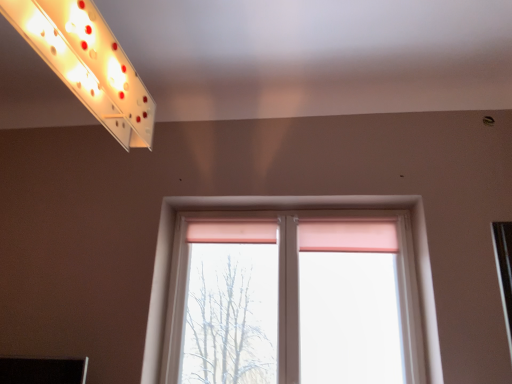
What do you see at coordinates (285, 208) in the screenshot? I see `pink fabric window at center` at bounding box center [285, 208].

Where is `pink fabric window at center`? The height and width of the screenshot is (384, 512). pink fabric window at center is located at coordinates (285, 208).

Locate an element on the screen. This screenshot has height=384, width=512. pink fabric window at center is located at coordinates (285, 208).